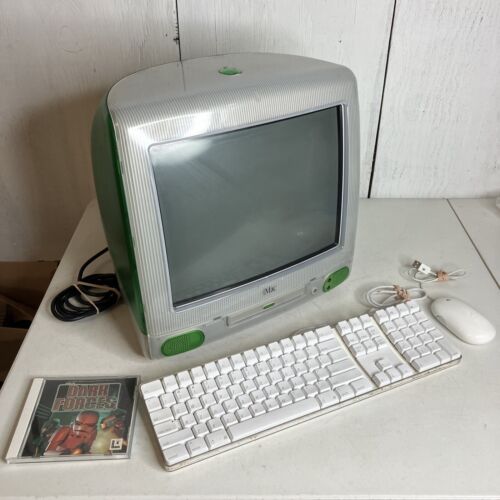
This screenshot has width=500, height=500. What are the coordinates of `cd` in the screenshot? It's located at (89, 401).